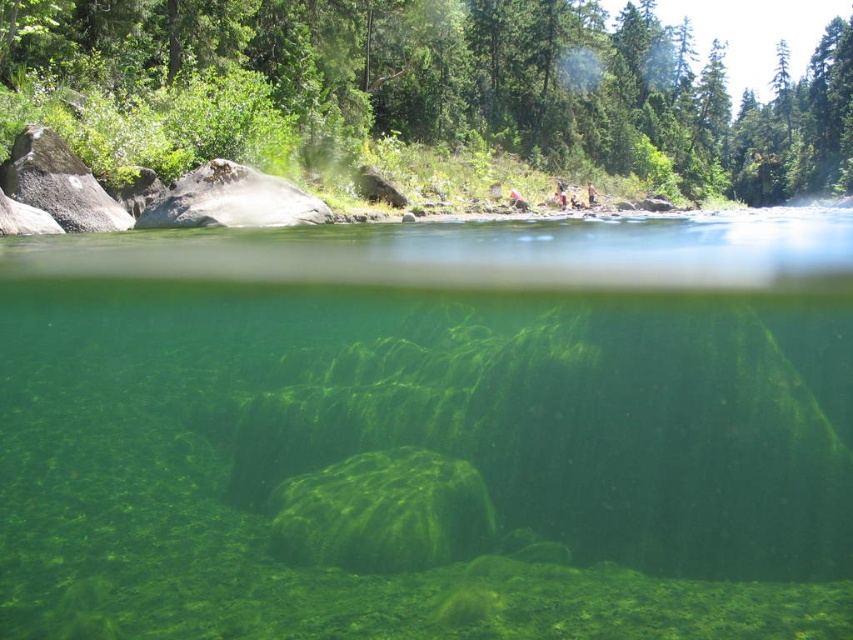
Question: Does transparent green algae at center have a lesser width compared to green leafy tree at upper center?

Choices:
 (A) no
 (B) yes

Answer: (B)

Question: Can you confirm if transparent green algae at center is smaller than green leafy tree at upper center?

Choices:
 (A) no
 (B) yes

Answer: (B)

Question: Can you confirm if transparent green algae at center is wider than green leafy tree at upper center?

Choices:
 (A) no
 (B) yes

Answer: (A)